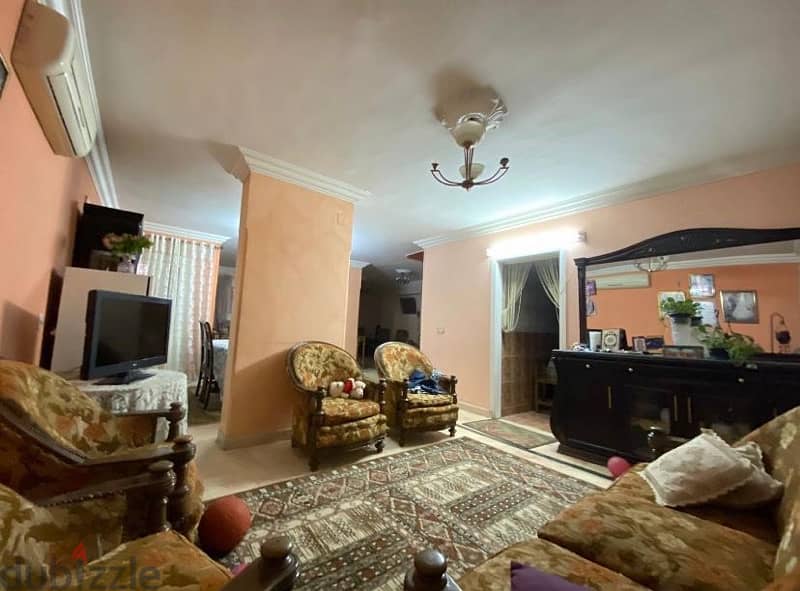
At what (x,y) coordinates should I click in order to perform the action: click on white pillows. Please return your answer as a coordinate pair (x, y). This screenshot has width=800, height=591. Looking at the image, I should click on (696, 472), (760, 488).